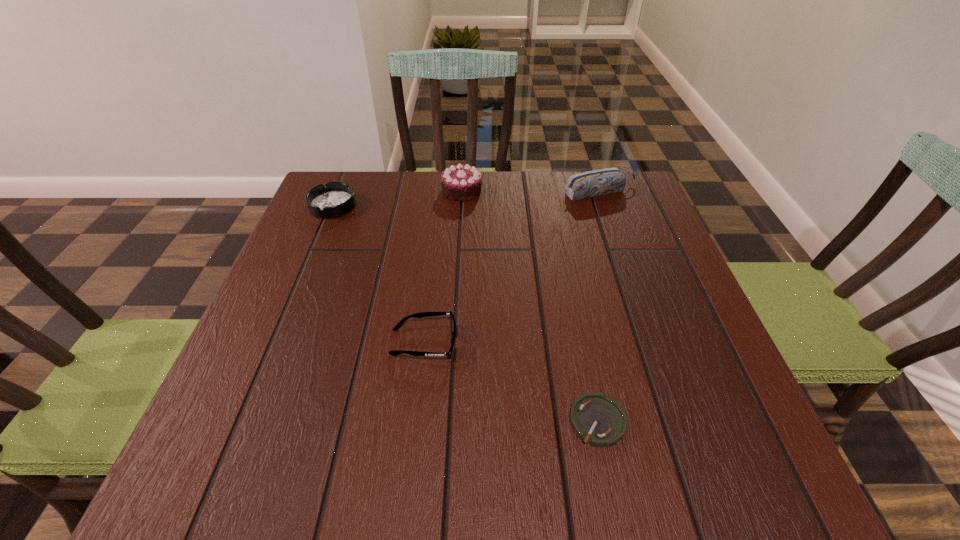
Where is `free space at the far edge of the desktop`? free space at the far edge of the desktop is located at coordinates (416, 184).

The width and height of the screenshot is (960, 540). In the image, there is a desktop. In order to click on vacant space at the near edge in this screenshot , I will do `click(508, 461)`.

Locate an element on the screen. vacant space at the left edge of the desktop is located at coordinates (351, 227).

Find the location of a particular element. The width and height of the screenshot is (960, 540). free space at the right edge of the desktop is located at coordinates (666, 380).

You are a GUI agent. You are given a task and a screenshot of the screen. Output one action in this format:
    pyautogui.click(x=<x>, y=<y>)
    Task: Click on the free location at the near left corner of the desktop
    Image resolution: width=960 pixels, height=540 pixels.
    Given the screenshot: What is the action you would take?
    (x=285, y=448)

Locate an element on the screen. The image size is (960, 540). vacant space at the far right corner of the desktop is located at coordinates (605, 201).

Find the location of a particular element. Image resolution: width=960 pixels, height=540 pixels. free spot between the second tallest object and the chocolate cake is located at coordinates (531, 191).

The width and height of the screenshot is (960, 540). I want to click on free area in between the chocolate cake and the fourth shortest object, so click(x=531, y=191).

Locate an element on the screen. This screenshot has height=540, width=960. empty space between the pencil box and the nearest object is located at coordinates click(599, 307).

Find the location of a particular element. unoccupied position between the left ashtray and the chocolate cake is located at coordinates (397, 198).